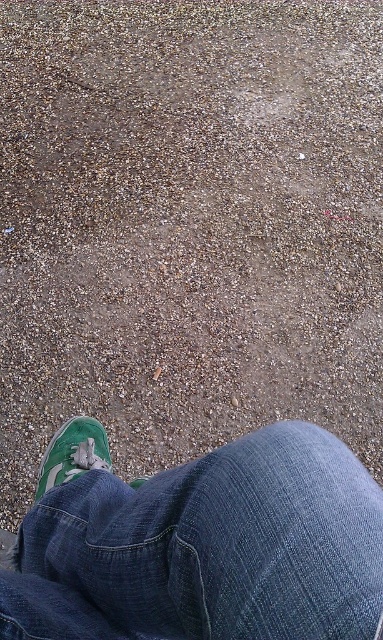
You are designing a shoe organizer that needs to accommodate both the denim at lower center and the green suede shoe at lower left. Given their sizes, which one requires more space in the organizer?

The denim at lower center requires more space in the organizer because it is larger in size than the green suede shoe at lower left according to the description.

You are a photographer taking a closeup photo of a person wearing dark blue jeans and green sneakers on a gravel path. You notice two points in your viewfinder labeled as point 1 at coordinates point [199,605] and point 2 at coordinates point [68,456]. Which point is closer to your camera lens?

Point [199,605] is closer to the camera lens than point [68,456].